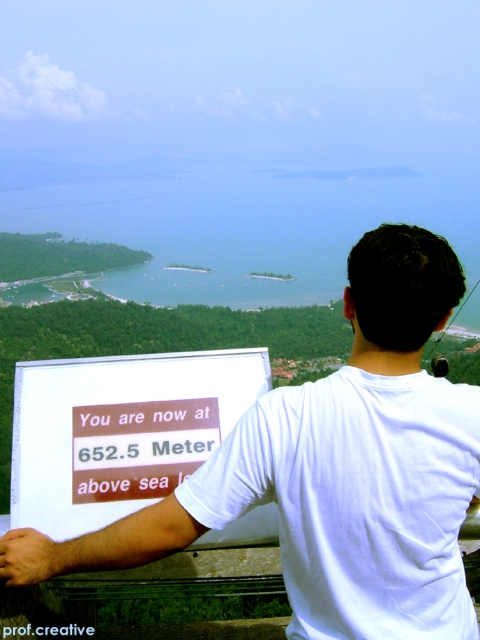
Who is lower down, white cotton shirt at center or white paper sign at center?

white paper sign at center is below.

From the picture: Does white cotton shirt at center have a greater height compared to white paper sign at center?

Yes.

Does point (6, 557) come closer to viewer compared to point (36, 465)?

Yes, it is in front of point (36, 465).

Find the location of `white cotton shirt at center`. white cotton shirt at center is located at coordinates (335, 470).

Between white cotton shirt at center and white cotton t-shirt at upper center, which one appears on the left side from the viewer's perspective?

From the viewer's perspective, white cotton t-shirt at upper center appears more on the left side.

I want to click on white cotton shirt at center, so click(x=335, y=470).

Based on the photo, does white cotton t-shirt at upper center appear over white paper sign at center?

Incorrect, white cotton t-shirt at upper center is not positioned above white paper sign at center.

Does point (408, 570) come in front of point (48, 500)?

Yes, it is in front of point (48, 500).

You are a GUI agent. You are given a task and a screenshot of the screen. Output one action in this format:
    pyautogui.click(x=<x>, y=<y>)
    Task: Click on the white cotton t-shirt at upper center
    This screenshot has width=480, height=640.
    Given the screenshot: What is the action you would take?
    pyautogui.click(x=357, y=499)